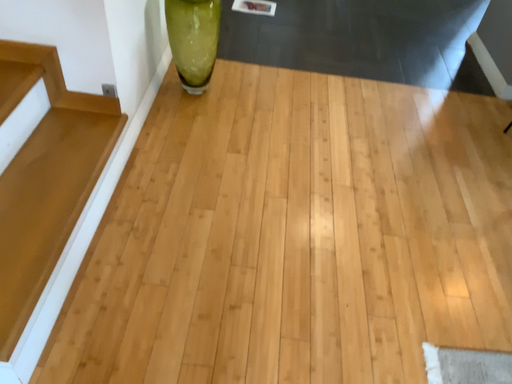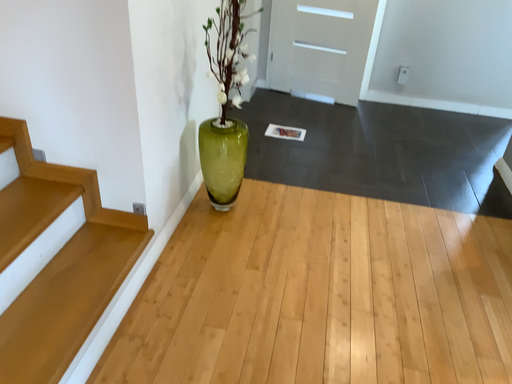
Question: How did the camera likely rotate when shooting the video?

Choices:
 (A) rotated downward
 (B) rotated upward

Answer: (B)